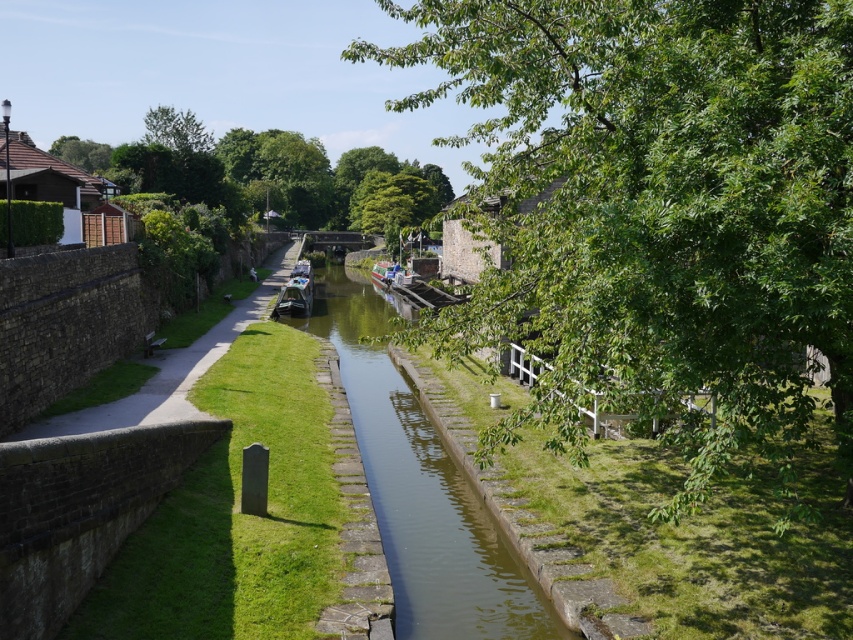
Question: Can you confirm if green leafy tree at upper center is positioned below smooth concrete path at left?

Choices:
 (A) yes
 (B) no

Answer: (B)

Question: Which of these objects is positioned farthest from the smooth concrete path at left?

Choices:
 (A) smooth black boat at center
 (B) green stone canal at center
 (C) green leafy tree at center

Answer: (C)

Question: From the image, what is the correct spatial relationship of green leafy tree at upper center in relation to smooth concrete path at left?

Choices:
 (A) below
 (B) above

Answer: (B)

Question: Which of the following is the farthest from the observer?

Choices:
 (A) smooth black boat at center
 (B) green stone canal at center
 (C) green leafy tree at upper center

Answer: (C)

Question: Does green stone canal at center have a smaller size compared to green leafy tree at upper center?

Choices:
 (A) yes
 (B) no

Answer: (A)

Question: Which point is closer to the camera taking this photo?

Choices:
 (A) (508, 579)
 (B) (172, 419)
 (C) (296, 276)

Answer: (A)